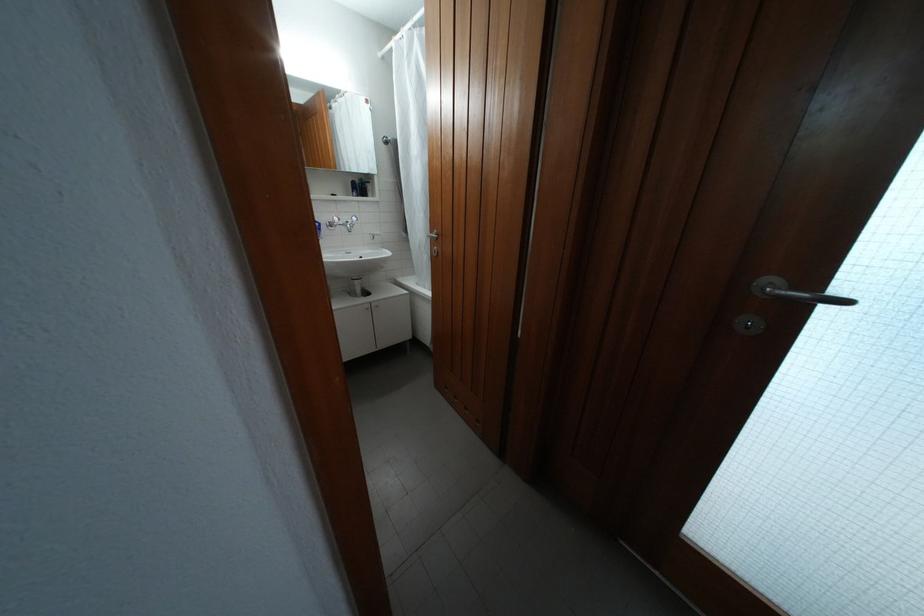
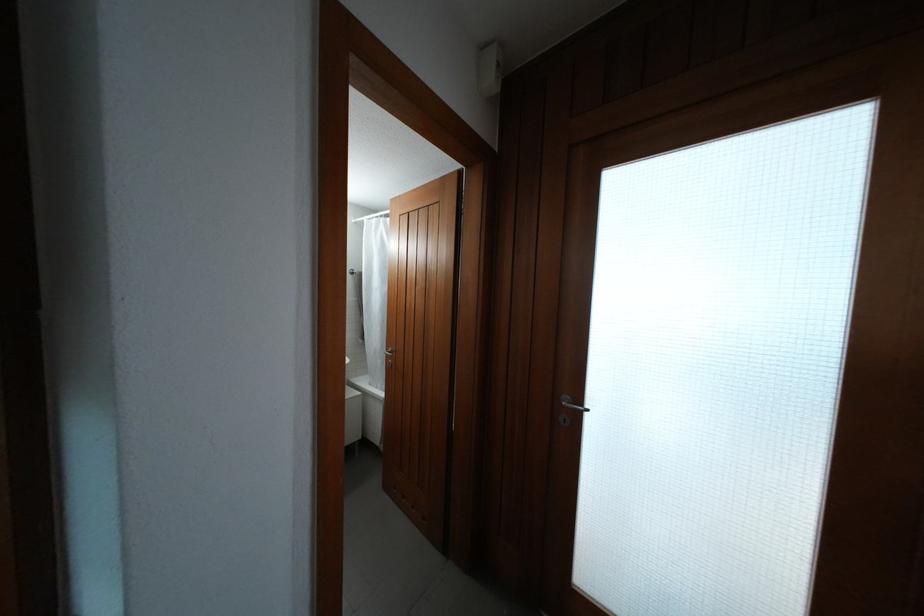
Question: How did the camera likely rotate?

Choices:
 (A) Left
 (B) Right
 (C) Up
 (D) Down

Answer: (C)